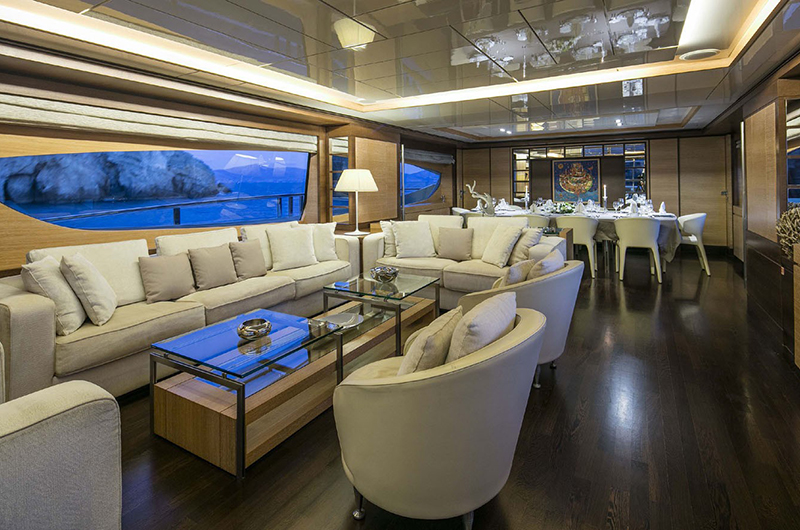
Where is `floor`? The image size is (800, 530). floor is located at coordinates (700, 449).